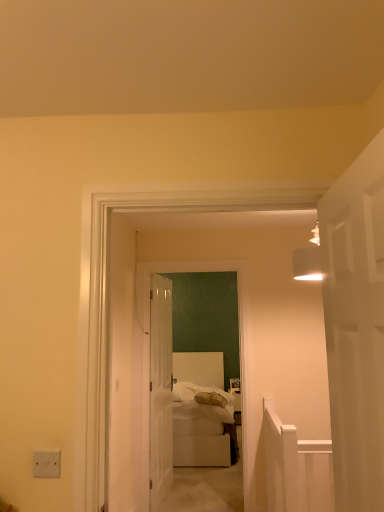
Question: Considering their positions, is white soft bed at center located in front of or behind white fluffy bedding at center?

Choices:
 (A) behind
 (B) front

Answer: (B)

Question: Do you think white soft bed at center is within white fluffy bedding at center, or outside of it?

Choices:
 (A) outside
 (B) inside

Answer: (A)

Question: Which of these objects is positioned closest to the white matte door at right, the second door when ordered from back to front?

Choices:
 (A) white fluffy bedding at center
 (B) white soft bed at center
 (C) white fabric bed at center
 (D) white plastic/light switch at lower left
 (E) clear glass door at center, which is the first door in back-to-front order

Answer: (D)

Question: Which object is positioned farthest from the white plastic/light switch at lower left?

Choices:
 (A) white matte door at right, which is counted as the first door, starting from the right
 (B) clear glass door at center, acting as the 2th door starting from the front
 (C) white fabric bed at center
 (D) white soft bed at center
 (E) white fluffy bedding at center

Answer: (E)